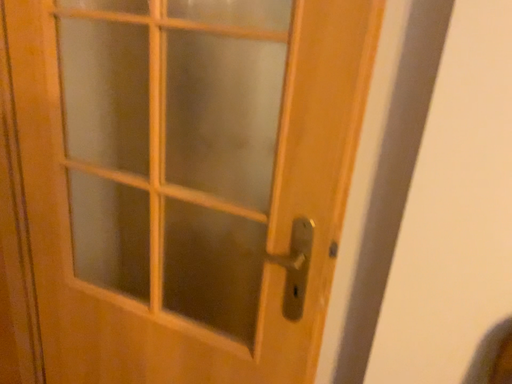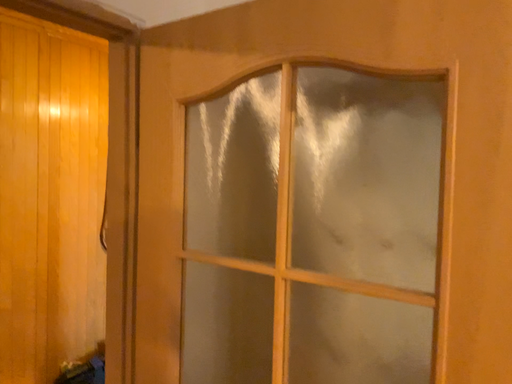
Question: How did the camera likely rotate when shooting the video?

Choices:
 (A) rotated upward
 (B) rotated downward

Answer: (A)